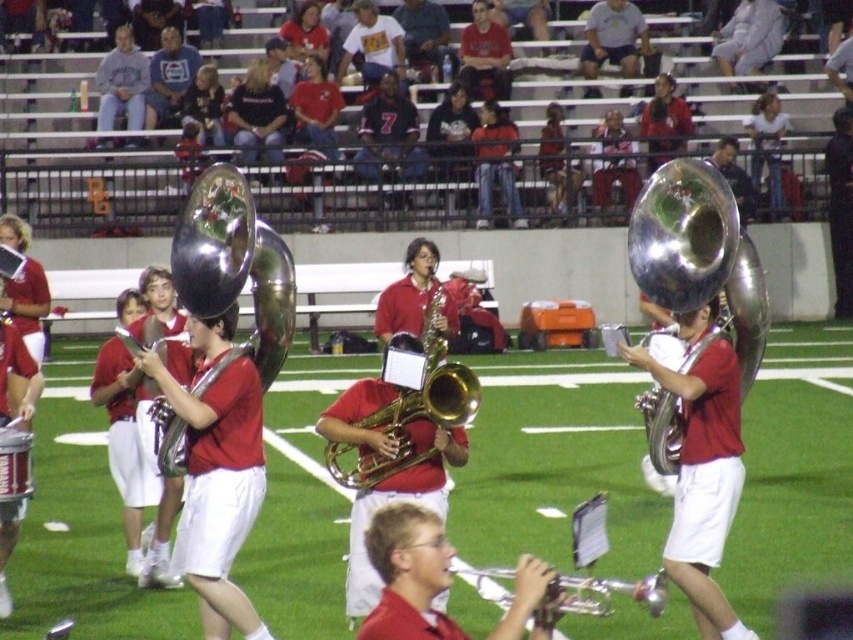
Question: Does matte brass tuba at center appear under gold brass trumpet at center?

Choices:
 (A) no
 (B) yes

Answer: (B)

Question: Can you confirm if matte brass tuba at center is wider than gold brass trumpet at center?

Choices:
 (A) yes
 (B) no

Answer: (B)

Question: Considering the real-world distances, which object is closest to the matte brass tuba at center?

Choices:
 (A) gold brass trumpet at center
 (B) silver metallic trumpet at lower center
 (C) shiny brass trumpet at center

Answer: (A)

Question: Considering the real-world distances, which object is closest to the matte brass tuba at center?

Choices:
 (A) shiny brass trumpet at center
 (B) silver metallic trumpet at lower center

Answer: (B)

Question: Considering the real-world distances, which object is farthest from the gold brass trumpet at center?

Choices:
 (A) shiny silver trumpet at center
 (B) silver metallic trumpet at lower center
 (C) shiny brass trumpet at center

Answer: (B)

Question: Is shiny silver trumpet at center wider than gold brass trumpet at center?

Choices:
 (A) yes
 (B) no

Answer: (B)